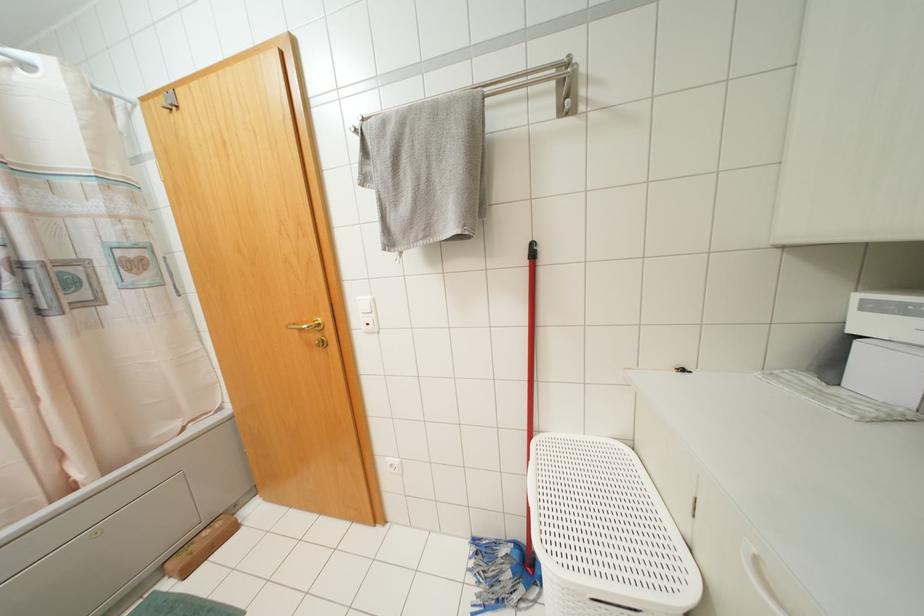
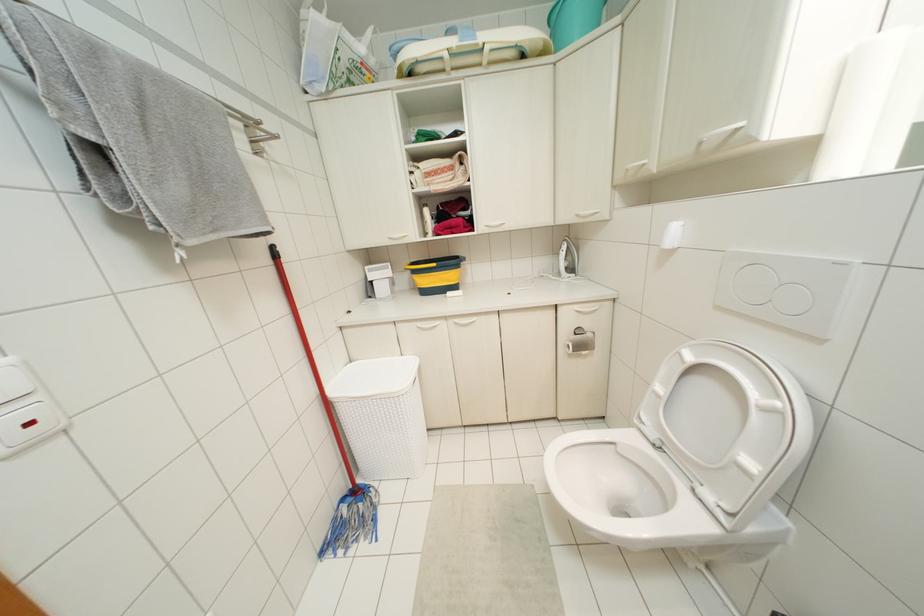
The point at (531,245) is marked in the first image. Where is the corresponding point in the second image?

(273, 246)